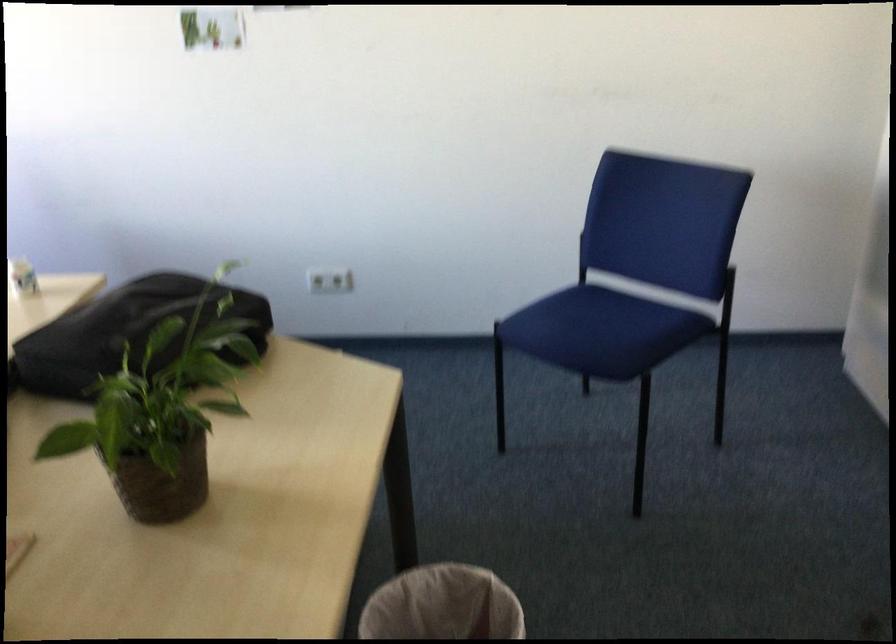
Describe the element at coordinates (616, 317) in the screenshot. Image resolution: width=896 pixels, height=644 pixels. I see `a chair sitting surface` at that location.